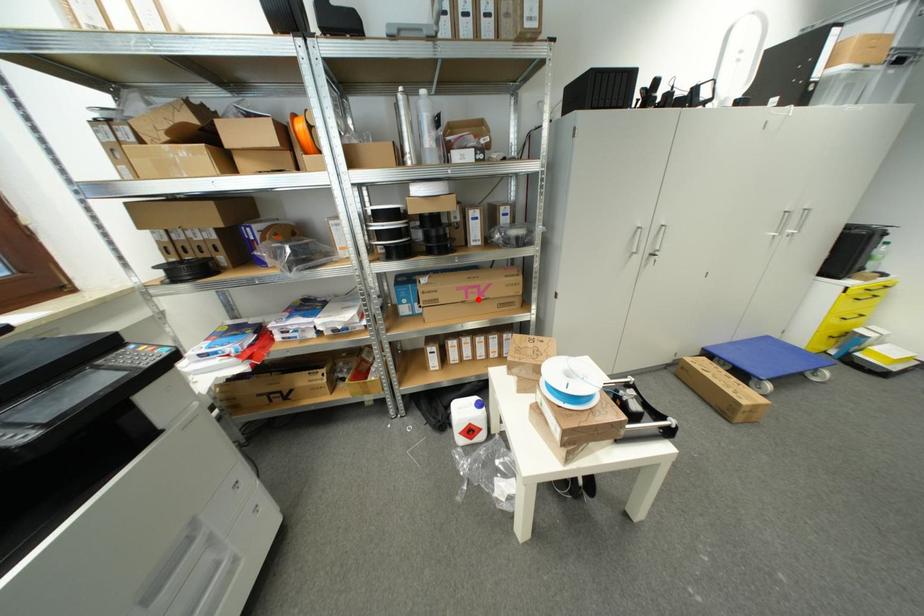
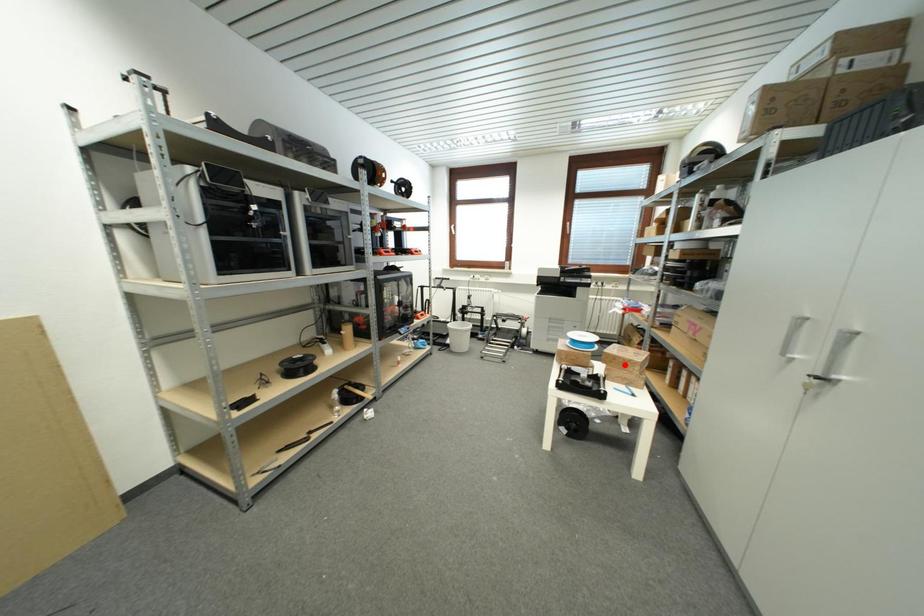
I am providing you with two images of the same scene from different viewpoints. A red point is marked on the first image and another point is marked on the second image. Does the point marked in image1 correspond to the same location as the one in image2?

No